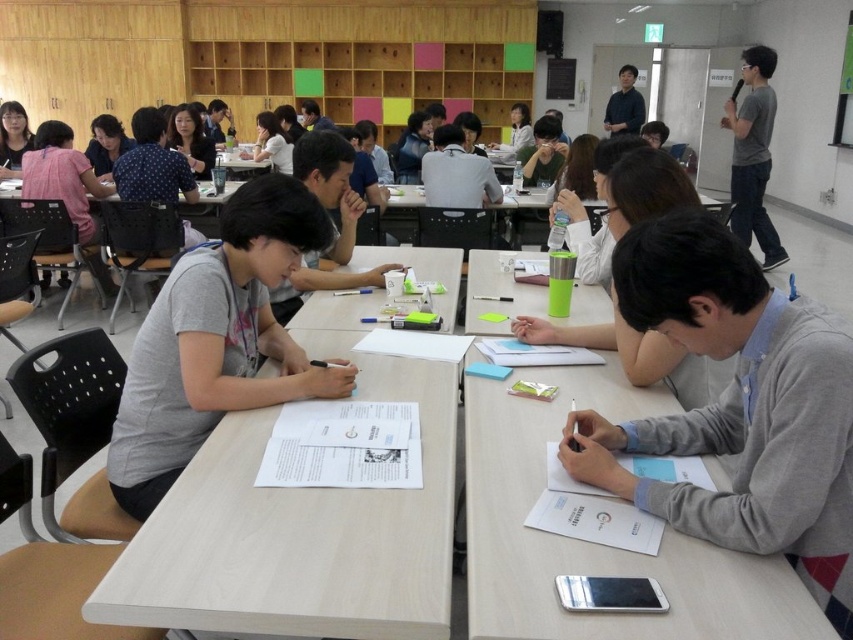
Question: Does gray sweater at lower right appear under white paper at center?

Choices:
 (A) no
 (B) yes

Answer: (B)

Question: Which point is closer to the camera taking this photo?

Choices:
 (A) (202, 554)
 (B) (0, 150)

Answer: (A)

Question: Which point is closer to the camera?

Choices:
 (A) white plastic table at center
 (B) matte black hair at upper left

Answer: (B)

Question: Can you confirm if gray matte shirt at center is wider than matte black hair at upper left?

Choices:
 (A) no
 (B) yes

Answer: (B)

Question: Does gray matte shirt at center have a smaller size compared to matte black shirt at upper right?

Choices:
 (A) yes
 (B) no

Answer: (A)

Question: Which object is positioned closest to the gray cotton shirt at center?

Choices:
 (A) matte black hair at upper left
 (B) gray matte shirt at upper right

Answer: (A)